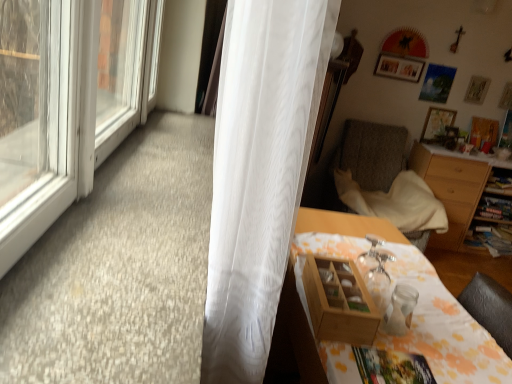
What are the coordinates of `vacant space to the right of wooden box at lower right` in the screenshot? It's located at (415, 322).